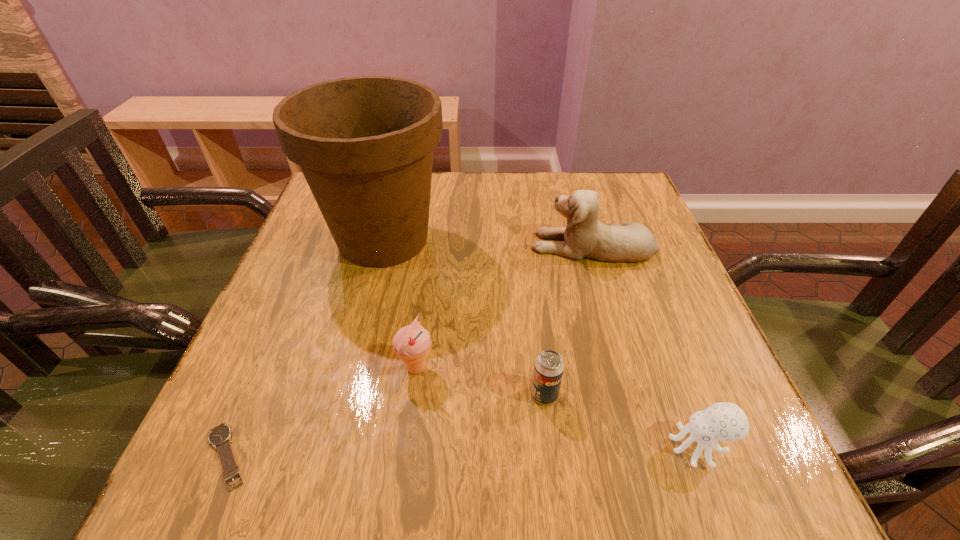
You are a GUI agent. You are given a task and a screenshot of the screen. Output one action in this format:
    pyautogui.click(x=<x>, y=<y>)
    Task: Click on the free region located 0.210m on the back of the fourth shortest object
    
    Given the screenshot: What is the action you would take?
    pyautogui.click(x=428, y=276)

At what (x,y) coordinates should I click in order to perform the action: click on vacant space located on the front-facing side of the octopus. Please return your answer as a coordinate pair (x, y). The height and width of the screenshot is (540, 960). Looking at the image, I should click on (547, 446).

Where is `free space located on the front-facing side of the octopus`? free space located on the front-facing side of the octopus is located at coordinates (554, 446).

Where is `free space located 0.230m on the front-facing side of the octopus`? The image size is (960, 540). free space located 0.230m on the front-facing side of the octopus is located at coordinates pyautogui.click(x=521, y=446).

This screenshot has height=540, width=960. In order to click on vacant area situated 0.200m on the back of the beer can in this screenshot , I will do `click(533, 300)`.

I want to click on vacant area located 0.240m on the back of the shortest object, so click(288, 313).

Locate an element on the screen. The width and height of the screenshot is (960, 540). object present at the far edge is located at coordinates (365, 145).

Locate an element on the screen. octopus situated at the near edge is located at coordinates (723, 421).

I want to click on watch present at the near edge, so click(220, 436).

Where is `flowerpot that is positioned at the left edge`? Image resolution: width=960 pixels, height=540 pixels. flowerpot that is positioned at the left edge is located at coordinates (365, 145).